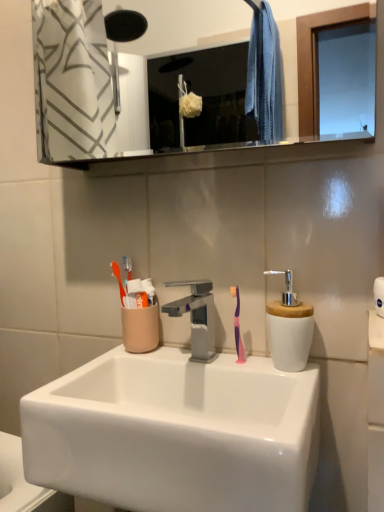
Question: Can you confirm if clear glass mirror at upper center is taller than white ceramic soap dispenser at right?

Choices:
 (A) no
 (B) yes

Answer: (B)

Question: From a real-world perspective, is clear glass mirror at upper center located higher than white ceramic soap dispenser at right?

Choices:
 (A) no
 (B) yes

Answer: (B)

Question: Considering the relative positions of clear glass mirror at upper center and white ceramic soap dispenser at right in the image provided, is clear glass mirror at upper center to the right of white ceramic soap dispenser at right from the viewer's perspective?

Choices:
 (A) no
 (B) yes

Answer: (A)

Question: Is clear glass mirror at upper center beside white ceramic soap dispenser at right?

Choices:
 (A) no
 (B) yes

Answer: (A)

Question: From a real-world perspective, is clear glass mirror at upper center under white ceramic soap dispenser at right?

Choices:
 (A) no
 (B) yes

Answer: (A)

Question: Is clear glass mirror at upper center facing away from white ceramic soap dispenser at right?

Choices:
 (A) yes
 (B) no

Answer: (B)

Question: Is pink rubber toothbrush at center in front of clear glass mirror at upper center?

Choices:
 (A) no
 (B) yes

Answer: (A)

Question: Does pink rubber toothbrush at center have a lesser height compared to clear glass mirror at upper center?

Choices:
 (A) yes
 (B) no

Answer: (A)

Question: Considering the relative sizes of pink rubber toothbrush at center and clear glass mirror at upper center in the image provided, is pink rubber toothbrush at center smaller than clear glass mirror at upper center?

Choices:
 (A) no
 (B) yes

Answer: (B)

Question: Considering the relative sizes of pink rubber toothbrush at center and clear glass mirror at upper center in the image provided, is pink rubber toothbrush at center taller than clear glass mirror at upper center?

Choices:
 (A) yes
 (B) no

Answer: (B)

Question: Is pink rubber toothbrush at center thinner than clear glass mirror at upper center?

Choices:
 (A) no
 (B) yes

Answer: (B)

Question: Does pink rubber toothbrush at center appear on the left side of clear glass mirror at upper center?

Choices:
 (A) yes
 (B) no

Answer: (B)

Question: Is satin nickel faucet at center smaller than clear glass mirror at upper center?

Choices:
 (A) yes
 (B) no

Answer: (A)